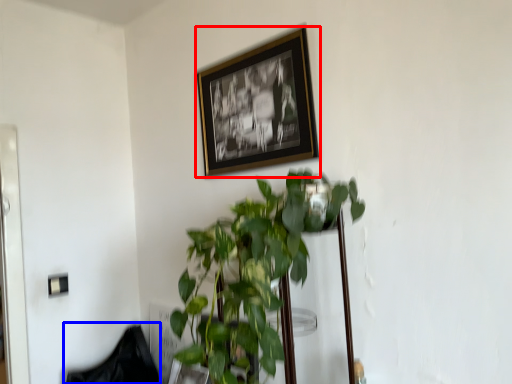
Question: Which object appears farthest to the camera in this image, picture frame (highlighted by a red box) or swivel chair (highlighted by a blue box)?

Choices:
 (A) picture frame
 (B) swivel chair

Answer: (B)